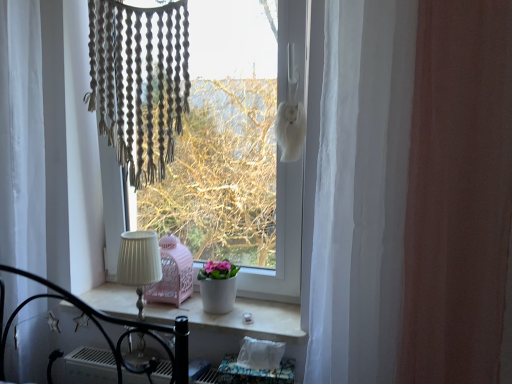
You are a GUI agent. You are given a task and a screenshot of the screen. Output one action in this format:
    pyautogui.click(x=<x>, y=<y>)
    Task: Click on the free spot to the right of white matte pot at center
    This screenshot has height=384, width=512.
    Given the screenshot: What is the action you would take?
    [264, 313]